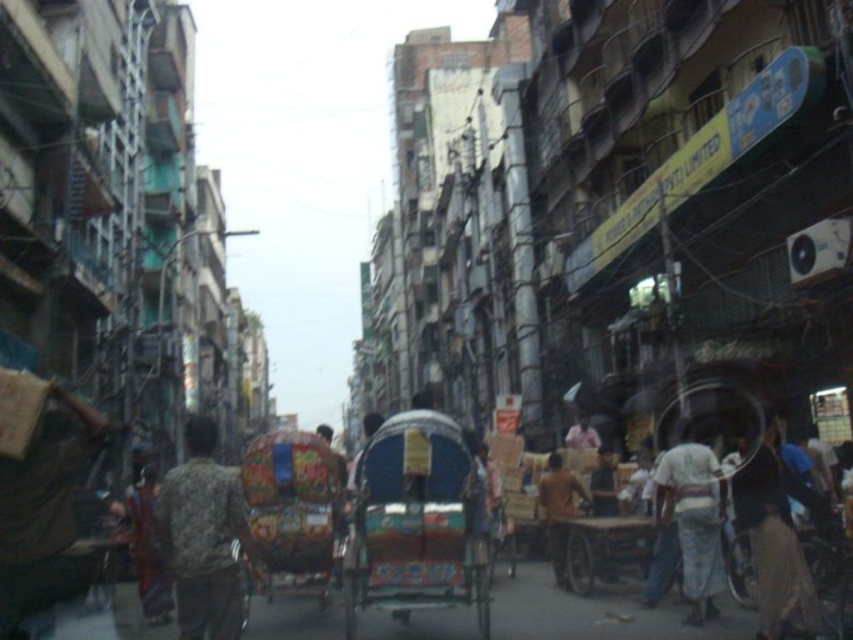
How far apart are decorative painted cart at center and dark blue fabric at center?

15.11 meters

Between decorative painted cart at center and dark blue fabric at center, which one is positioned higher?

decorative painted cart at center is higher up.

The width and height of the screenshot is (853, 640). Describe the element at coordinates (416, 522) in the screenshot. I see `decorative painted cart at center` at that location.

In order to click on decorative painted cart at center in this screenshot , I will do `click(416, 522)`.

Who is more forward, (x=663, y=484) or (x=548, y=500)?

Positioned in front is point (x=663, y=484).

Is point (694, 474) positioned before point (560, 506)?

Yes, point (694, 474) is in front of point (560, 506).

Identify the location of white cotton shirt at center. (693, 518).

Is camouflage fabric jacket at center bigger than light brown fabric bag at lower right?

Indeed, camouflage fabric jacket at center has a larger size compared to light brown fabric bag at lower right.

The width and height of the screenshot is (853, 640). I want to click on camouflage fabric jacket at center, so click(x=204, y=536).

The width and height of the screenshot is (853, 640). In order to click on camouflage fabric jacket at center in this screenshot , I will do `click(204, 536)`.